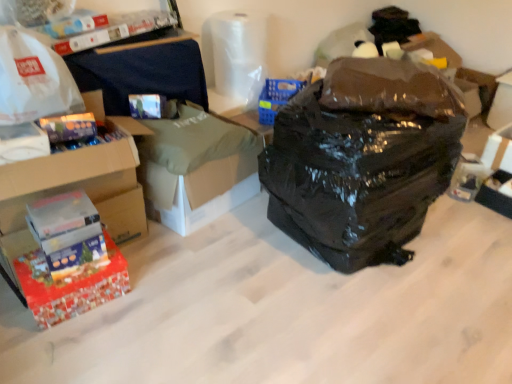
Question: Considering the relative positions of white cardboard box at center and white cardboard box at right, placed as the second storage box when sorted from top to bottom, in the image provided, is white cardboard box at center to the left or to the right of white cardboard box at right, placed as the second storage box when sorted from top to bottom,?

Choices:
 (A) right
 (B) left

Answer: (B)

Question: Would you say white cardboard box at center is inside or outside white cardboard box at right, the second storage box from the bottom?

Choices:
 (A) outside
 (B) inside

Answer: (A)

Question: Estimate the real-world distances between objects in this image. Which object is closer to the red cardboard box at lower left, marked as the second box in a bottom-to-top arrangement?

Choices:
 (A) red glossy box at lower left, the 1th box from the bottom
 (B) black plastic storage box at lower right, arranged as the 1th storage box when viewed from the front
 (C) black plastic storage box at upper right, arranged as the third storage box when ordered from the bottom
 (D) matte cardboard box at lower left, acting as the third box starting from the bottom
 (E) white matte plastic bag at upper left

Answer: (D)

Question: Estimate the real-world distances between objects in this image. Which object is closer to the transparent plastic toilet paper at upper center?

Choices:
 (A) red cardboard box at lower left, marked as the second box in a bottom-to-top arrangement
 (B) white matte plastic bag at upper left
 (C) matte cardboard box at lower left, arranged as the 1th box when viewed from the top
 (D) white cardboard box at center
 (E) black plastic bag at center

Answer: (D)